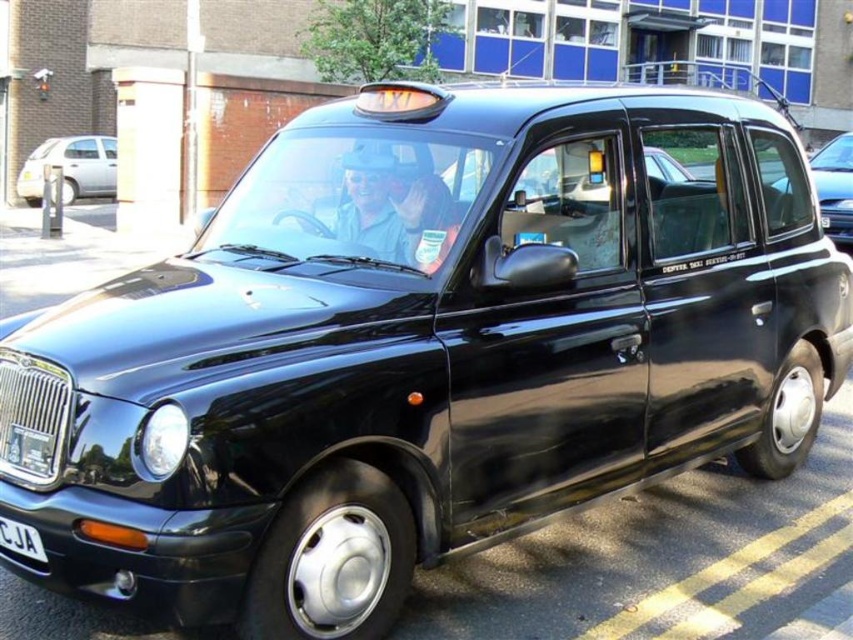
Question: Does silver metallic hatchback at left appear on the left side of black matte taxi at right?

Choices:
 (A) yes
 (B) no

Answer: (A)

Question: Which point is farther to the camera?

Choices:
 (A) (837, 198)
 (B) (15, 525)
 (C) (91, 156)

Answer: (C)

Question: Does silver metallic hatchback at left lie behind white plastic license plate at lower left?

Choices:
 (A) no
 (B) yes

Answer: (B)

Question: Is silver metallic hatchback at left wider than black matte taxi at right?

Choices:
 (A) yes
 (B) no

Answer: (B)

Question: Which is nearer to the silver metallic hatchback at left?

Choices:
 (A) white plastic license plate at lower left
 (B) black matte taxi at right

Answer: (B)

Question: Which is nearer to the silver metallic hatchback at left?

Choices:
 (A) white plastic license plate at lower left
 (B) black matte taxi at right

Answer: (B)